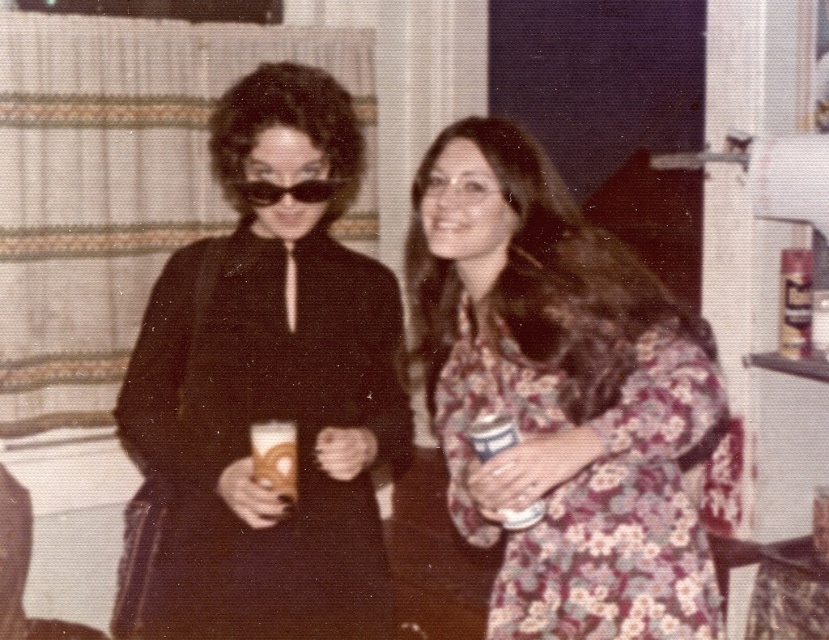
What is located at the point with coordinates [561,396] in the image?

The point at coordinates [561,396] is on a floral patterned dress at center.